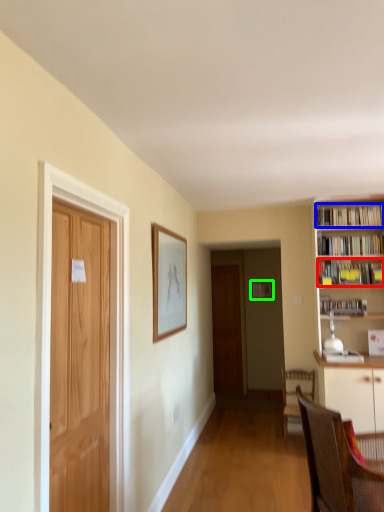
Question: Which object is the closest to the book (highlighted by a red box)? Choose among these: book (highlighted by a blue box) or picture frame (highlighted by a green box).

Choices:
 (A) book
 (B) picture frame

Answer: (A)